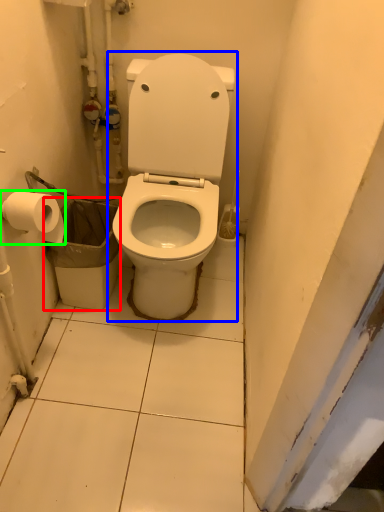
Question: Which is farther away from garbage (highlighted by a red box)? toilet (highlighted by a blue box) or toilet paper (highlighted by a green box)?

Choices:
 (A) toilet
 (B) toilet paper

Answer: (B)